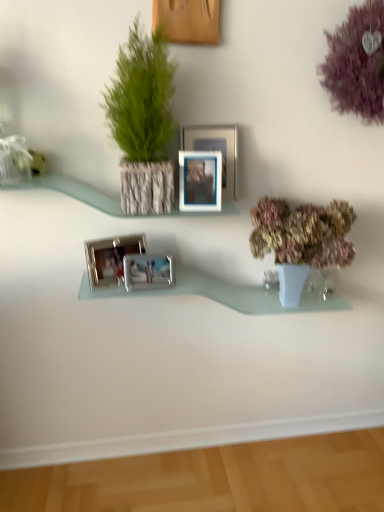
I want to click on vacant space underneath matte wooden shelf at upper center, which is the 2th shelf from bottom to top (from a real-world perspective), so click(x=163, y=458).